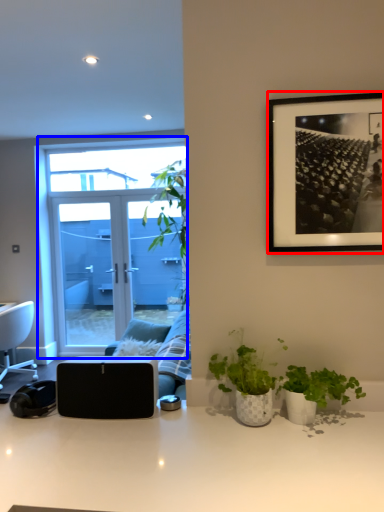
Question: Which object is further to the camera taking this photo, picture frame (highlighted by a red box) or window (highlighted by a blue box)?

Choices:
 (A) picture frame
 (B) window

Answer: (B)